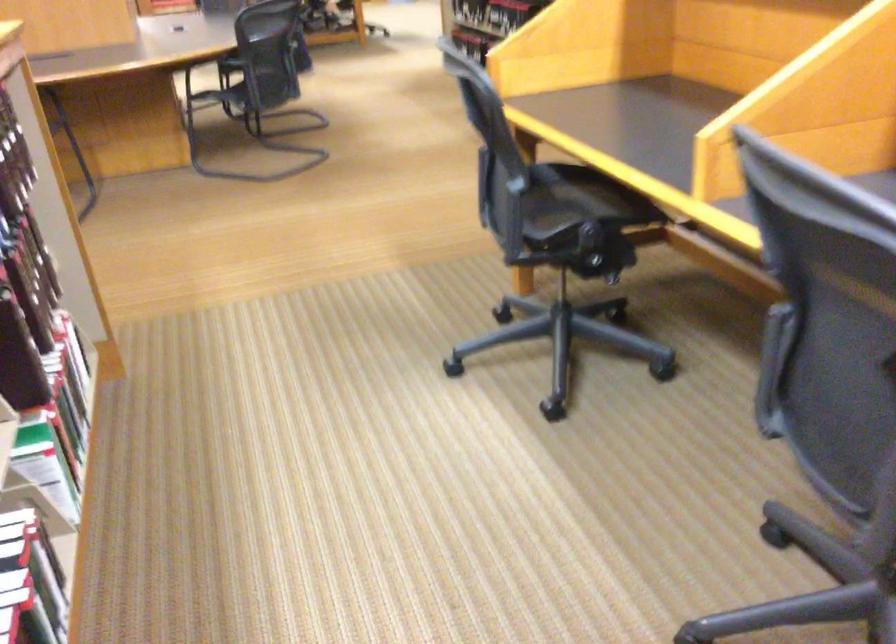
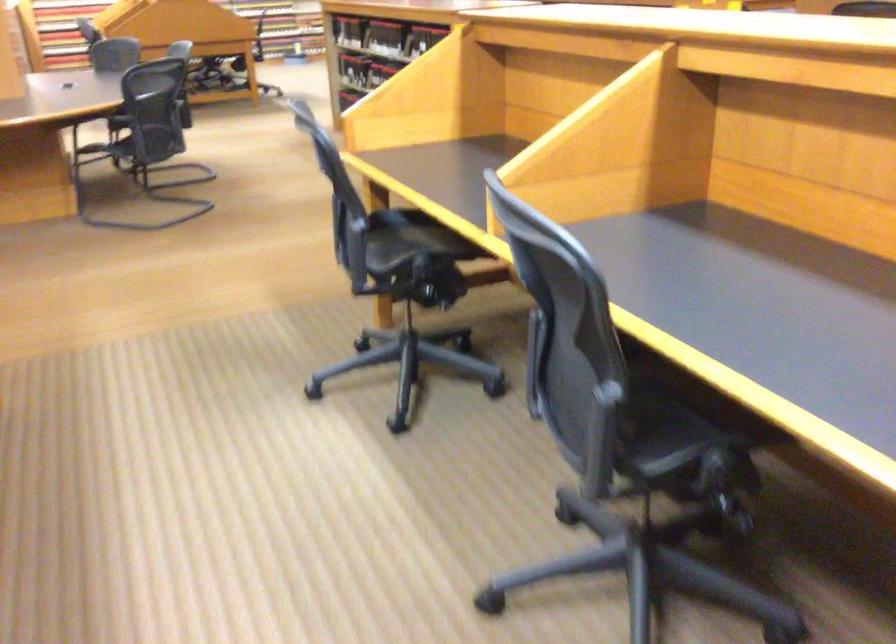
Question: The first image is from the beginning of the video and the second image is from the end. How did the camera likely rotate when shooting the video?

Choices:
 (A) Left
 (B) Right
 (C) Up
 (D) Down

Answer: (B)